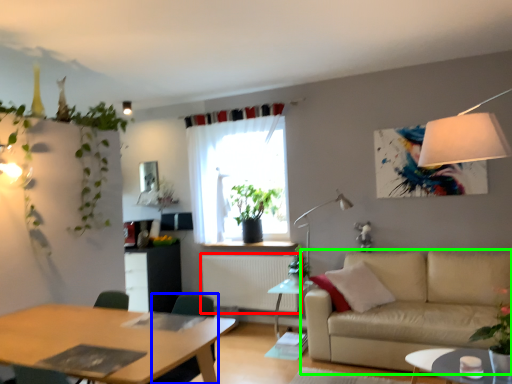
Question: Which object is the farthest from radiator (highlighted by a red box)? Choose among these: swivel chair (highlighted by a blue box) or studio couch (highlighted by a green box).

Choices:
 (A) swivel chair
 (B) studio couch

Answer: (A)